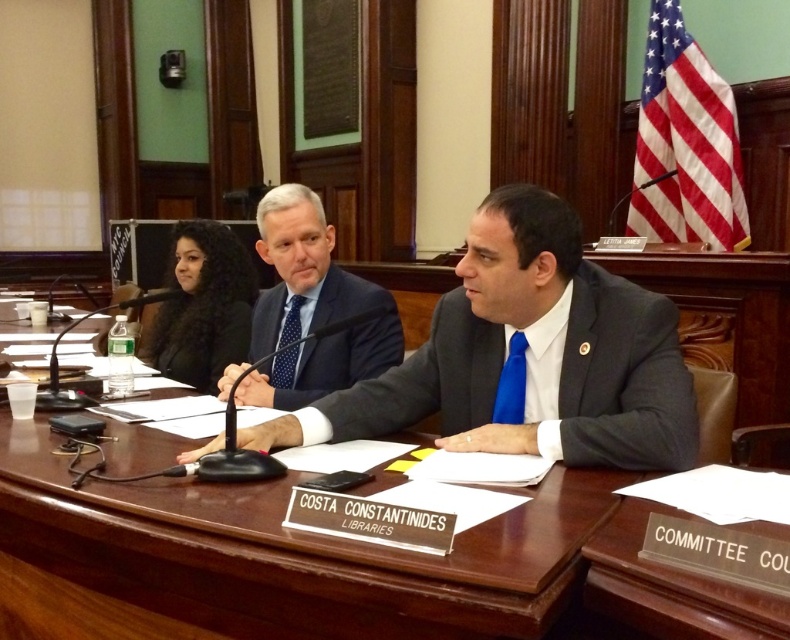
You are a photographer standing behind the long wooden table in the legislative setting. You need to capture a closeup shot of both the blue silk tie at center and the polka dot silk tie at center in the same frame. Given that your camera has a maximum focus range of 28 inches, will you be able to include both ties in focus in the photo?

The blue silk tie at center and polka dot silk tie at center are 28.03 inches apart. Since the camera can only focus within 28 inches, the distance between them exceeds the maximum focus range. Therefore, both ties cannot be in focus simultaneously in the photo.

You are an event planner arranging a meeting. The wooden table at center and the blue silk tie at center are both in the room. Which object is wider?

The wooden table at center is wider than the blue silk tie at center.